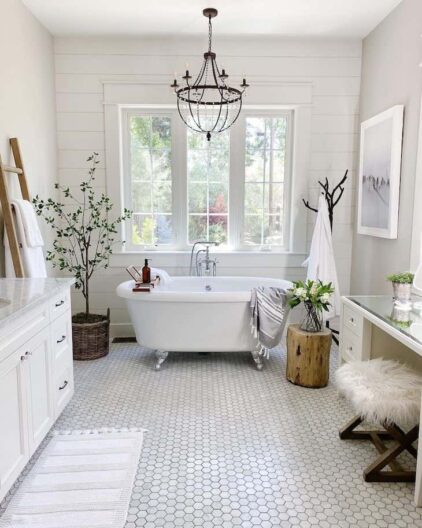
This screenshot has height=528, width=422. What are the coordinates of `basket` in the screenshot? It's located at (96, 339).